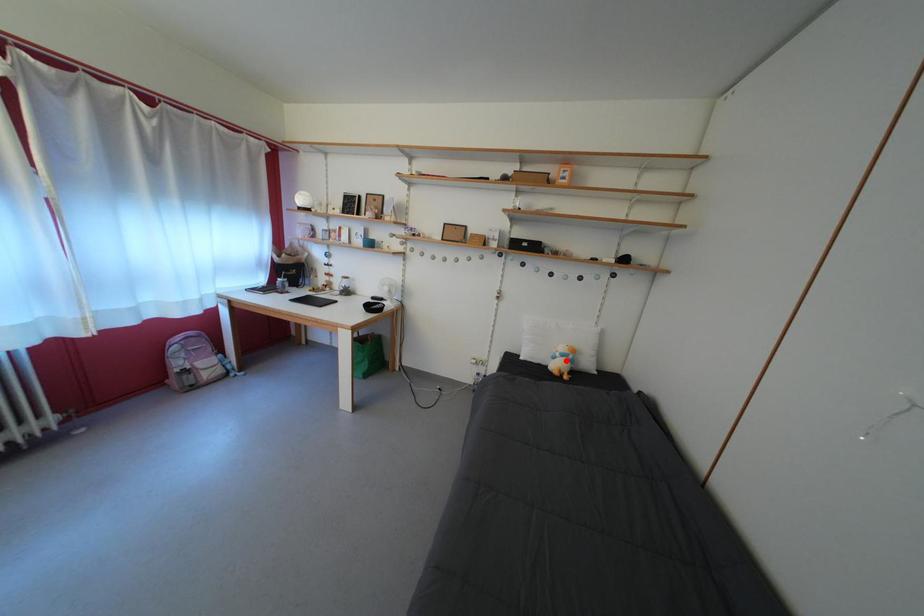
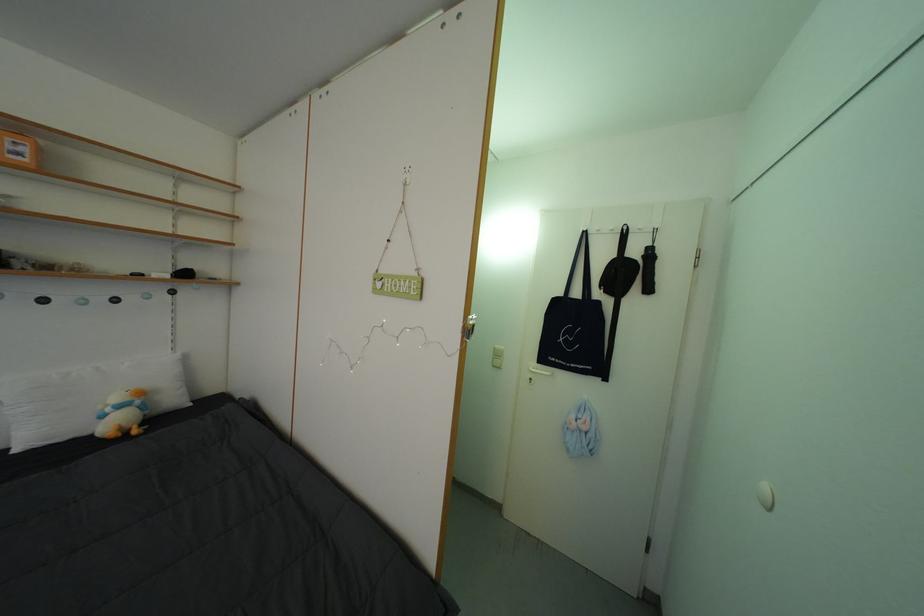
Question: I am providing you with two images of the same scene from different viewpoints. A red point is shown in image1. For the corresponding object point in image2, is it positioned nearer or farther from the camera?

Choices:
 (A) Nearer
 (B) Farther

Answer: (A)